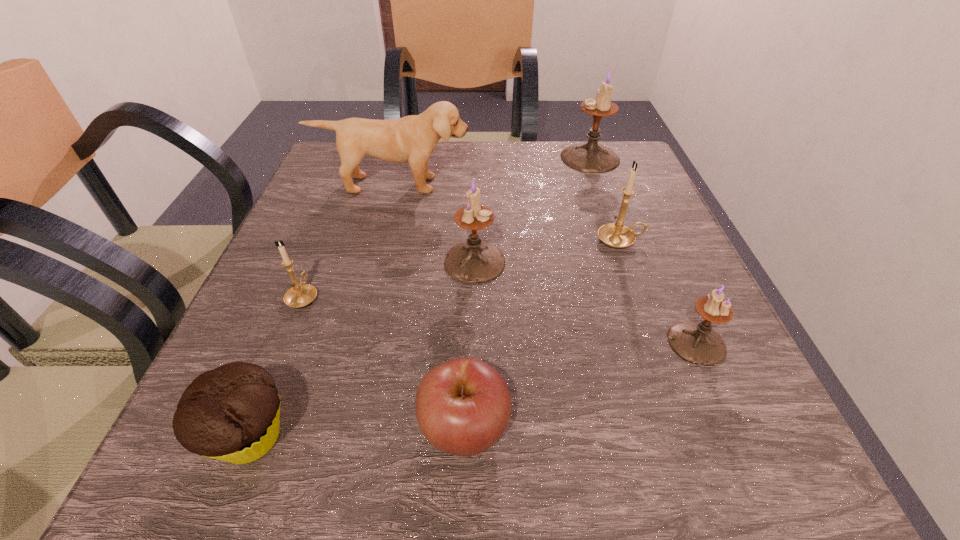
The height and width of the screenshot is (540, 960). Identify the location of blank region between the muffin and the second biggest purple candle holder. (363, 350).

Where is `vacant point located between the puppy and the muffin`? vacant point located between the puppy and the muffin is located at coordinates (322, 311).

Where is `unoccupied area between the puppy and the smaller gold candle holder`? The image size is (960, 540). unoccupied area between the puppy and the smaller gold candle holder is located at coordinates point(348,240).

Identify the location of vacant point located between the nearer gold candle holder and the smallest purple candle holder. (500, 320).

Locate an element on the screen. The height and width of the screenshot is (540, 960). vacant area between the chocolate muffin and the leftmost purple candle holder is located at coordinates (363, 350).

Where is `free spot between the beige puppy and the tallest candle holder`? free spot between the beige puppy and the tallest candle holder is located at coordinates (492, 171).

Locate an element on the screen. This screenshot has height=540, width=960. empty space that is in between the second biggest purple candle holder and the farthest purple candle holder is located at coordinates (532, 210).

The image size is (960, 540). I want to click on vacant point located between the apple and the chocolate muffin, so click(x=357, y=433).

The width and height of the screenshot is (960, 540). I want to click on vacant space that is in between the nearer gold candle holder and the beige puppy, so click(348, 240).

Locate an element on the screen. This screenshot has height=540, width=960. the seventh closest object to the farthest candle holder is located at coordinates (232, 413).